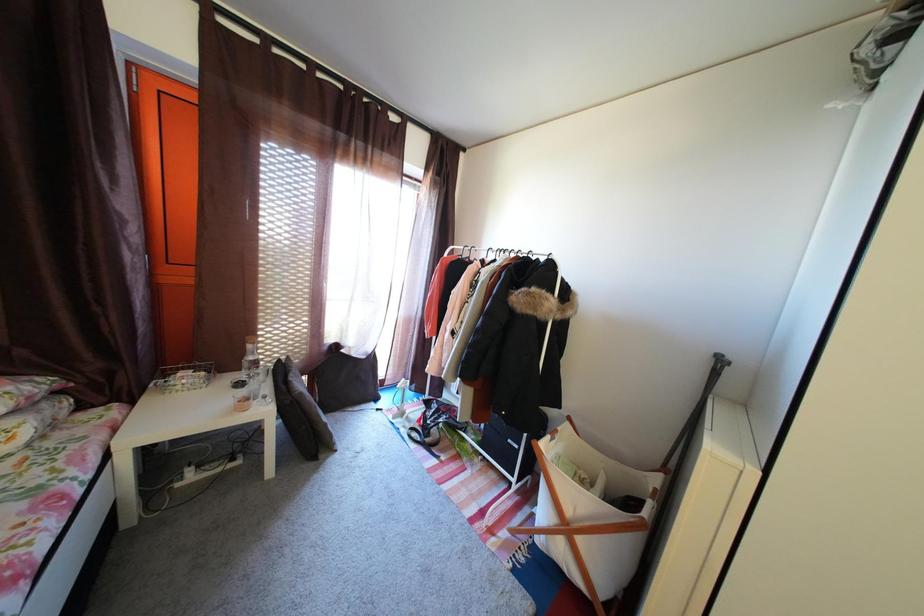
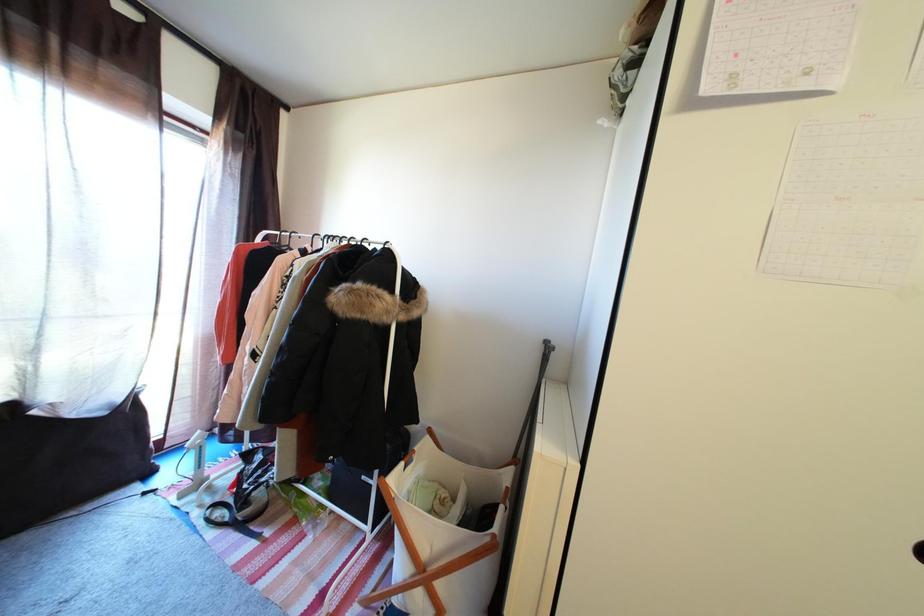
In a continuous first-person perspective shot, in which direction is the camera moving?

The cameraman walked toward right, forward.